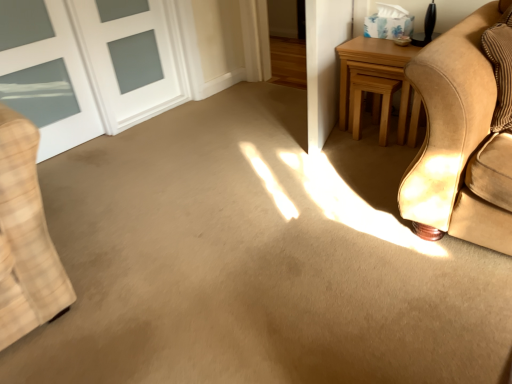
Question: From the image's perspective, would you say light brown wood stool at upper right is shown under white glass door at upper left?

Choices:
 (A) yes
 (B) no

Answer: (A)

Question: From a real-world perspective, does light brown wood stool at upper right stand above white glass door at upper left?

Choices:
 (A) yes
 (B) no

Answer: (B)

Question: Does light brown wood stool at upper right have a lesser height compared to white glass door at upper left?

Choices:
 (A) no
 (B) yes

Answer: (B)

Question: Considering the relative sizes of light brown wood stool at upper right and white glass door at upper left in the image provided, is light brown wood stool at upper right smaller than white glass door at upper left?

Choices:
 (A) no
 (B) yes

Answer: (B)

Question: From a real-world perspective, is light brown wood stool at upper right physically below white glass door at upper left?

Choices:
 (A) yes
 (B) no

Answer: (A)

Question: From the image's perspective, is light brown wooden table at right located above or below white glass door at upper left?

Choices:
 (A) above
 (B) below

Answer: (B)

Question: Based on their positions, is light brown wooden table at right located to the left or right of white glass door at upper left?

Choices:
 (A) left
 (B) right

Answer: (B)

Question: From a real-world perspective, relative to white glass door at upper left, is light brown wooden table at right vertically above or below?

Choices:
 (A) above
 (B) below

Answer: (B)

Question: Does point (358, 36) appear closer or farther from the camera than point (37, 74)?

Choices:
 (A) farther
 (B) closer

Answer: (A)

Question: From a real-world perspective, is light brown wood stool at upper right above or below light brown wooden table at right?

Choices:
 (A) above
 (B) below

Answer: (B)

Question: Based on their sizes in the image, would you say light brown wood stool at upper right is bigger or smaller than light brown wooden table at right?

Choices:
 (A) big
 (B) small

Answer: (B)

Question: Considering the positions of light brown wood stool at upper right and light brown wooden table at right in the image, is light brown wood stool at upper right taller or shorter than light brown wooden table at right?

Choices:
 (A) tall
 (B) short

Answer: (B)

Question: Is light brown wood stool at upper right to the left or to the right of light brown wooden table at right in the image?

Choices:
 (A) right
 (B) left

Answer: (B)

Question: Do you think light brown wood stool at upper right is within white glass door at upper left, or outside of it?

Choices:
 (A) outside
 (B) inside

Answer: (A)

Question: Considering their positions, is light brown wood stool at upper right located in front of or behind white glass door at upper left?

Choices:
 (A) front
 (B) behind

Answer: (B)